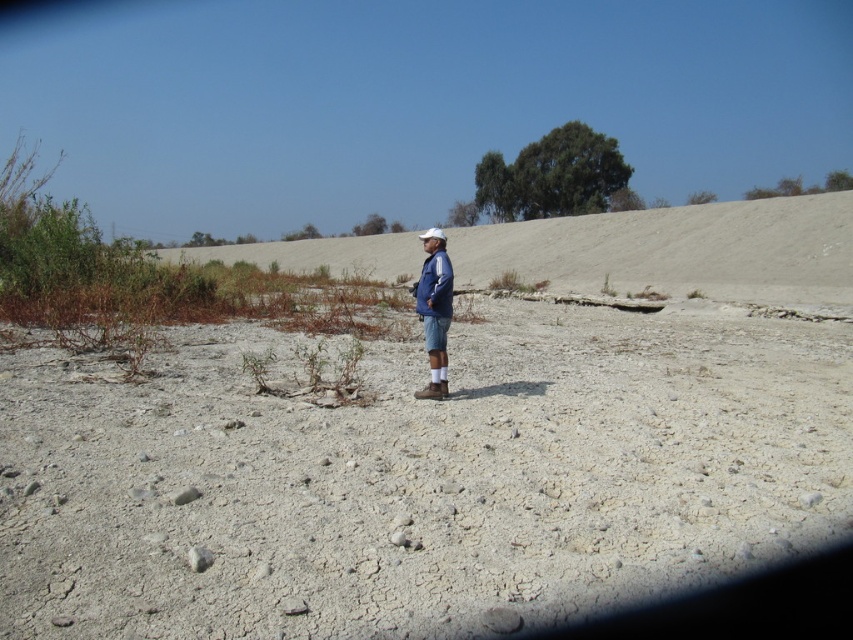
You are a hiker trying to cross the smooth sand hill at center. You have a blue denim jacket at center with you. If you want to use the jacket to cover your face from the sand, will its width be sufficient to cover your face while you climb the hill?

The smooth sand hill at center is wider than the blue denim jacket at center, but the width of the jacket itself is not specified. However, since the question is about covering your face, the jacket can be adjusted to cover your face regardless of its width compared to the hill.

You are standing at the point marked as point [677,250] in the image. What is the terrain like at that location?

The terrain at point [677,250] is a smooth sand hill at center.